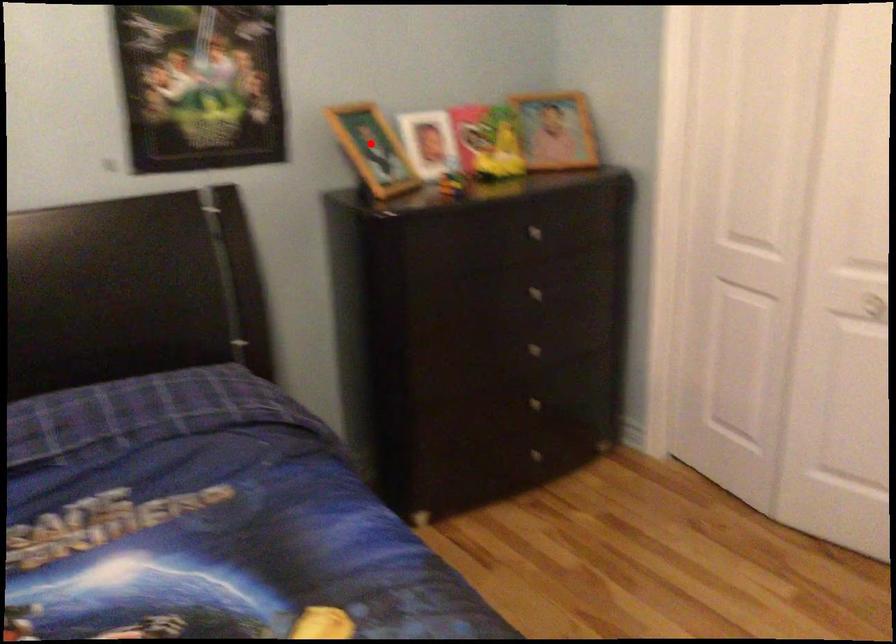
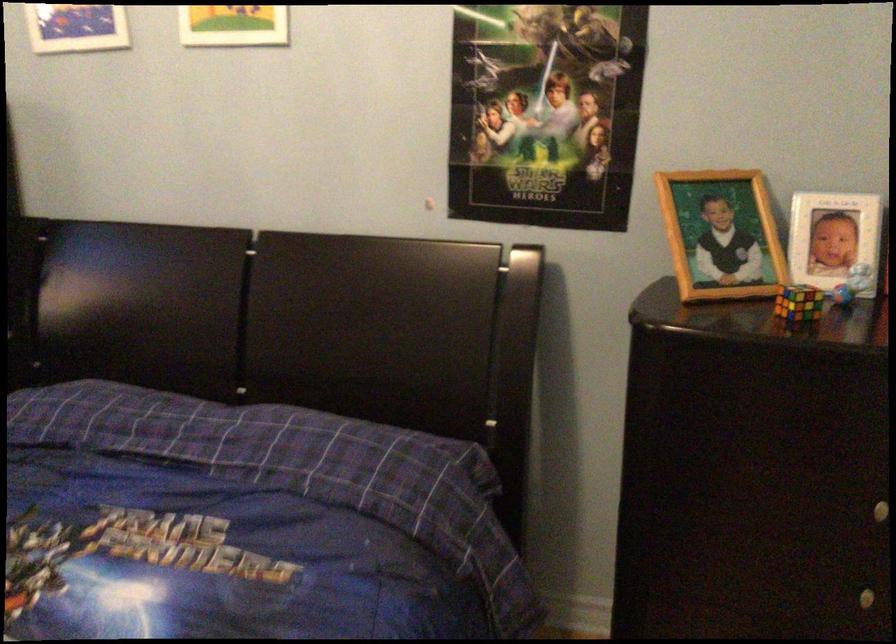
In the second image, find the point that corresponds to the highlighted location in the first image.

(720, 234)